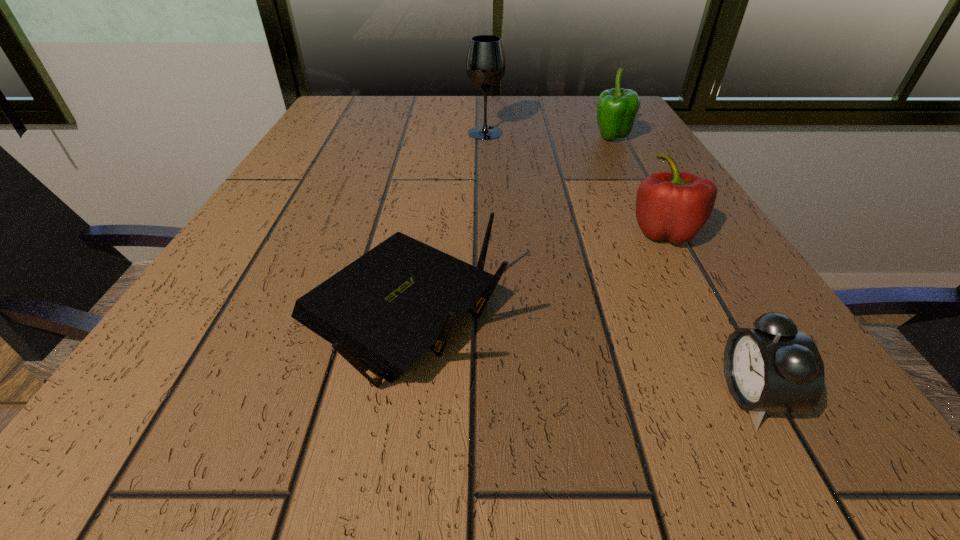
The image size is (960, 540). Identify the location of wineglass. (485, 64).

Where is `the taller bell pepper`? the taller bell pepper is located at coordinates (617, 108).

Find the location of a particular element. The image size is (960, 540). the fourth shortest object is located at coordinates pos(617,108).

You are a GUI agent. You are given a task and a screenshot of the screen. Output one action in this format:
    pyautogui.click(x=<x>, y=<y>)
    Task: Click on the router
    The image size is (960, 540).
    Given the screenshot: What is the action you would take?
    pos(382,312)

This screenshot has width=960, height=540. Find the location of `the nearer bell pepper`. the nearer bell pepper is located at coordinates (675, 206).

You are a GUI agent. You are given a task and a screenshot of the screen. Output one action in this format:
    pyautogui.click(x=<x>, y=<y>)
    Task: Click on the alarm clock
    The width and height of the screenshot is (960, 540).
    Given the screenshot: What is the action you would take?
    pyautogui.click(x=774, y=367)

I want to click on free space located 0.110m on the right of the wineglass, so click(551, 133).

The image size is (960, 540). Find the location of `vacant space positioned on the front of the taller bell pepper`. vacant space positioned on the front of the taller bell pepper is located at coordinates (632, 177).

Image resolution: width=960 pixels, height=540 pixels. I want to click on free spot located on the right of the router, so pyautogui.click(x=696, y=315).

Locate an element on the screen. blank area located on the back of the nearer bell pepper is located at coordinates (612, 134).